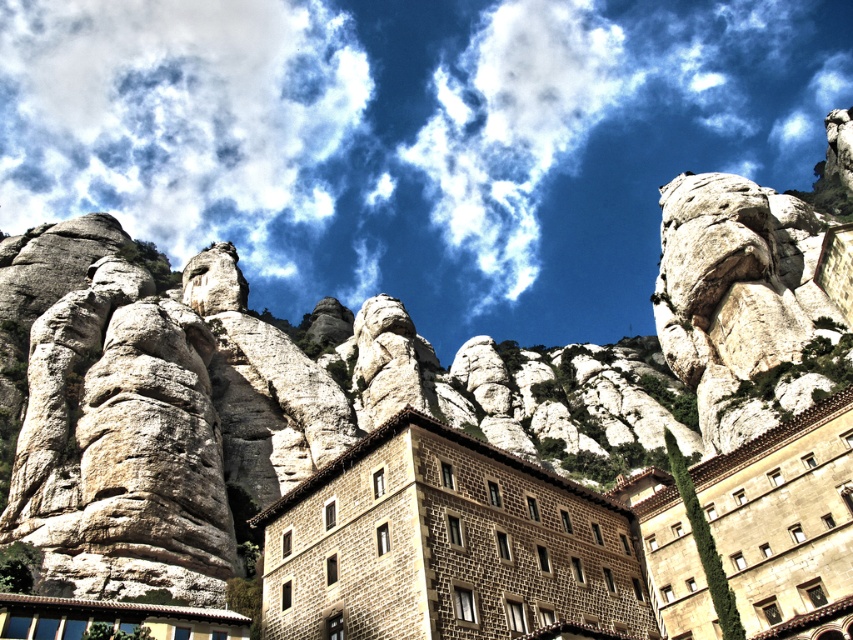
You are standing at the base of the rock formations and want to take a photo of the point at coordinate point (x=161, y=188). Based on the distance provided, will the point be in focus if your camera has a depth of field that can clearly capture objects up to 500 meters away?

The point at coordinate point (x=161, y=188) is 452.93 meters away from the camera. Since this distance is within the camera depth of field range of up to 500 meters, the point will be in focus.

You are an architect designing a new building that needs to be visible from the brown stone building at center. Based on the scene, where should you place the new building so it won not be blocked by the white fluffy cloud at upper center?

The white fluffy cloud at upper center is above the brown stone building at center, so placing the new building to the side or below the brown stone building at center would ensure it remains visible without being blocked by the cloud.

You are an architect designing a new building that needs to fit in with the existing brown stone building at center. You notice a white fluffy cloud at upper center in the distance. Which one has a greater width when viewed from your current position?

The white fluffy cloud at upper center has a greater width than the brown stone building at center.